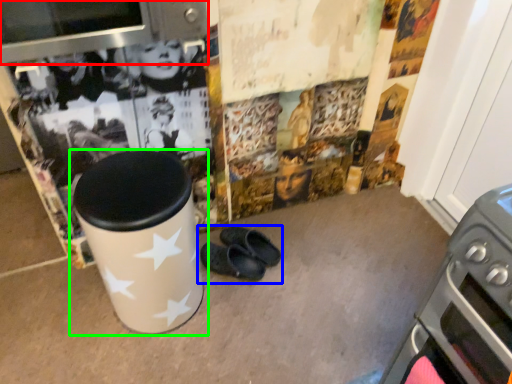
Question: Based on their relative distances, which object is farther from appliance (highlighted by a red box)? Choose from footwear (highlighted by a blue box) and waste container (highlighted by a green box).

Choices:
 (A) footwear
 (B) waste container

Answer: (A)